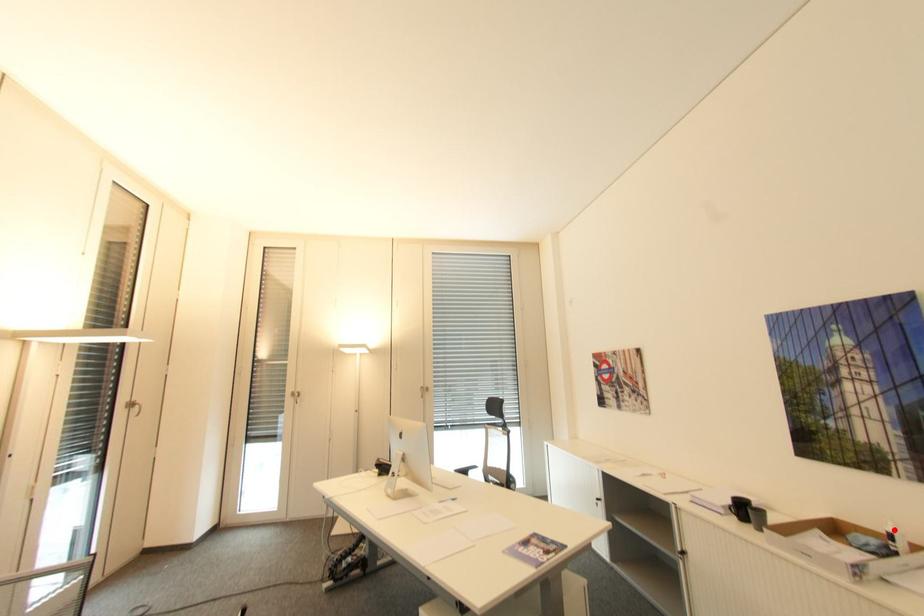
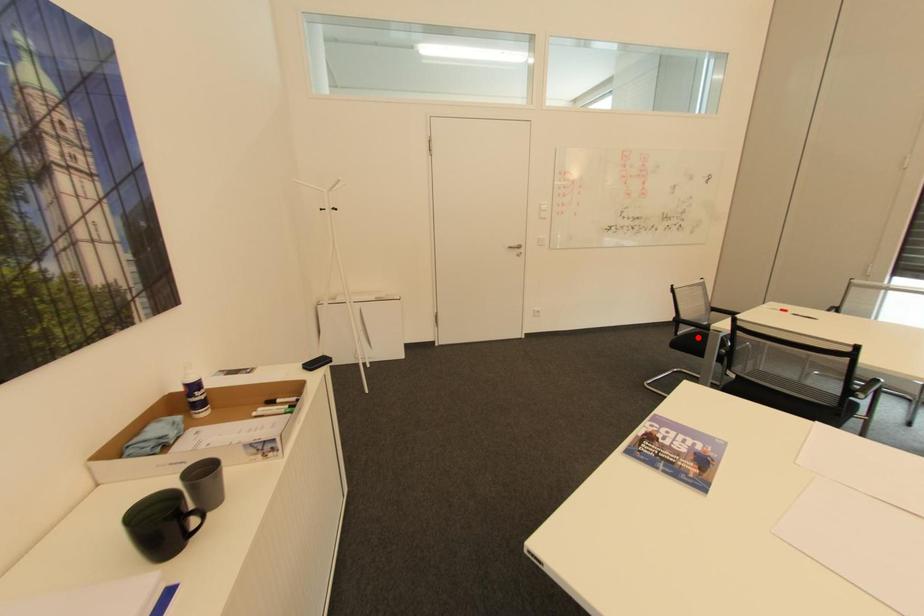
I am providing you with two images of the same scene from different viewpoints. A red point is marked on the first image and another point is marked on the second image. Is the red point in image1 aligned with the point shown in image2?

No